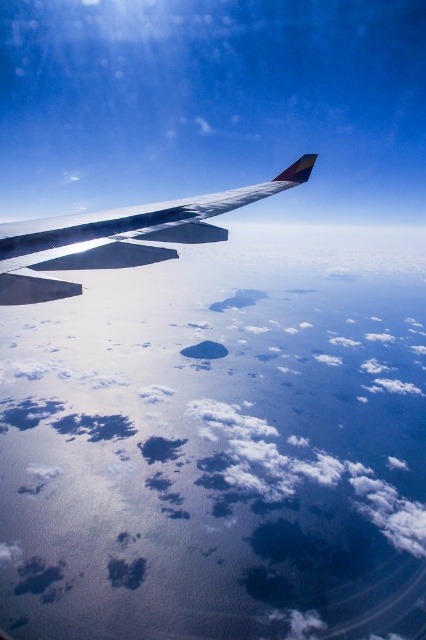
Question: Is white fluffy cloud at upper center thinner than metallic silver wing at upper left?

Choices:
 (A) yes
 (B) no

Answer: (B)

Question: Can you confirm if white fluffy cloud at upper center is positioned to the right of metallic silver wing at upper left?

Choices:
 (A) no
 (B) yes

Answer: (A)

Question: Among these points, which one is farthest from the camera?

Choices:
 (A) (20, 257)
 (B) (397, 481)

Answer: (B)

Question: Can you confirm if white fluffy cloud at upper center is bigger than metallic silver wing at upper left?

Choices:
 (A) yes
 (B) no

Answer: (A)

Question: Among these points, which one is farthest from the camera?

Choices:
 (A) (195, 214)
 (B) (66, 433)

Answer: (B)